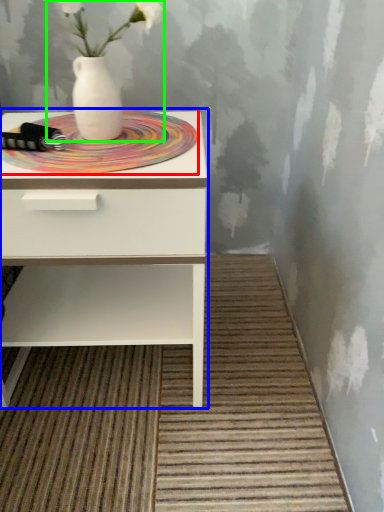
Question: Based on their relative distances, which object is farther from mat (highlighted by a red box)? Choose from nightstand (highlighted by a blue box) and floral arrangement (highlighted by a green box).

Choices:
 (A) nightstand
 (B) floral arrangement

Answer: (A)